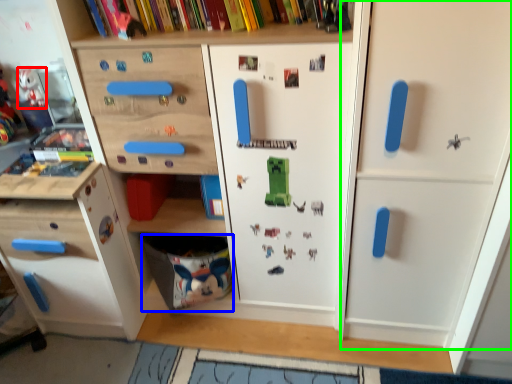
Question: Based on their relative distances, which object is farther from toy (highlighted by a red box)? Choose from drawer (highlighted by a blue box) and door (highlighted by a green box).

Choices:
 (A) drawer
 (B) door

Answer: (B)